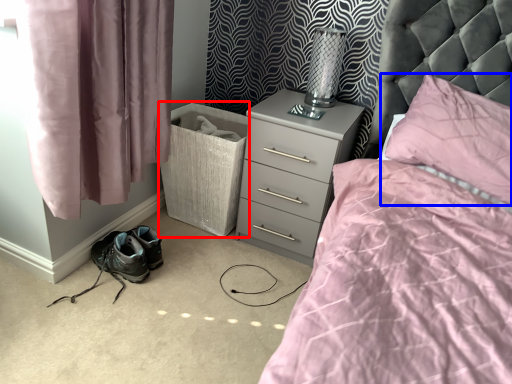
Question: Which object is further to the camera taking this photo, laundry basket (highlighted by a red box) or pillow (highlighted by a blue box)?

Choices:
 (A) laundry basket
 (B) pillow

Answer: (A)